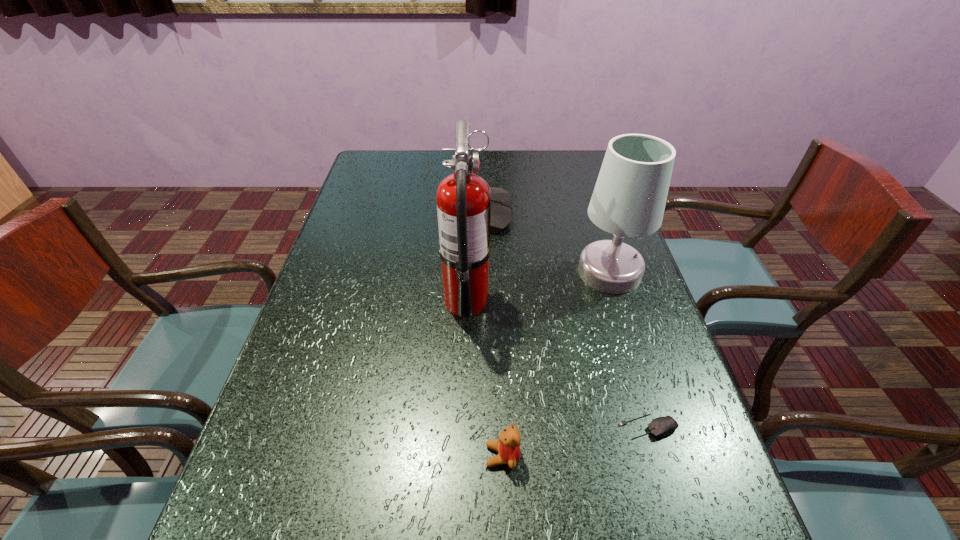
The height and width of the screenshot is (540, 960). I want to click on vacant space located 0.190m on the back of the router, so click(402, 213).

The width and height of the screenshot is (960, 540). What are the coordinates of `vacant space situated 0.230m on the front-facing side of the second shortest object` in the screenshot? It's located at (360, 456).

Image resolution: width=960 pixels, height=540 pixels. I want to click on free location located on the front-facing side of the second shortest object, so click(360, 456).

I want to click on vacant space located 0.310m on the front-facing side of the second shortest object, so (x=317, y=456).

Where is `free space located 0.210m on the left of the mouse`? free space located 0.210m on the left of the mouse is located at coordinates (510, 427).

Image resolution: width=960 pixels, height=540 pixels. I want to click on lampshade at the right edge, so click(629, 198).

Find the location of a particular element. mouse that is at the right edge is located at coordinates (662, 426).

This screenshot has height=540, width=960. I want to click on free spot at the far edge of the desktop, so pyautogui.click(x=411, y=156).

The width and height of the screenshot is (960, 540). I want to click on vacant space at the left edge, so click(x=384, y=227).

Find the location of a particular element. This screenshot has height=540, width=960. free space at the right edge of the desktop is located at coordinates (659, 462).